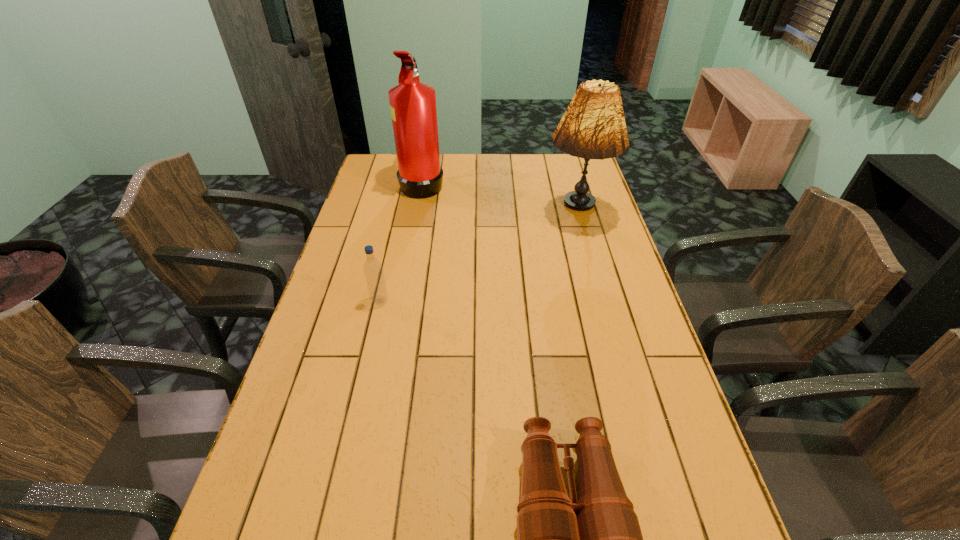
Choose which object is the nearest neighbor to the fire extinguisher. Please provide its 2D coordinates. Your answer should be formatted as a tuple, i.e. [(x, y)], where the tuple contains the x and y coordinates of a point satisfying the conditions above.

[(593, 126)]